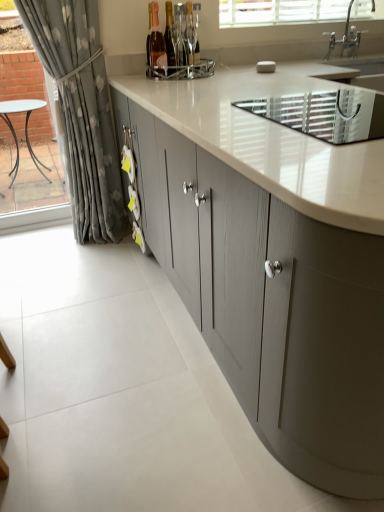
Question: Which direction should I rotate to look at matte glass bottle at center, which is the 1th bottle in right-to-left order, — up or down?

Choices:
 (A) up
 (B) down

Answer: (A)

Question: From the image's perspective, would you say matte glass bottle at center, which is the 1th bottle in right-to-left order, is positioned over clear glass window frame at left?

Choices:
 (A) no
 (B) yes

Answer: (B)

Question: Is matte glass bottle at center, which is the 1th bottle in right-to-left order, bigger than clear glass window frame at left?

Choices:
 (A) yes
 (B) no

Answer: (B)

Question: Are matte glass bottle at center, which is the 1th bottle in right-to-left order, and clear glass window frame at left beside each other?

Choices:
 (A) yes
 (B) no

Answer: (B)

Question: Does matte glass bottle at center, which is the third bottle from left to right, come behind clear glass window frame at left?

Choices:
 (A) yes
 (B) no

Answer: (A)

Question: From a real-world perspective, is matte glass bottle at center, which is the 1th bottle in right-to-left order, positioned under clear glass window frame at left based on gravity?

Choices:
 (A) yes
 (B) no

Answer: (B)

Question: Can you confirm if matte glass bottle at center, which is the 1th bottle in right-to-left order, is smaller than clear glass window frame at left?

Choices:
 (A) no
 (B) yes

Answer: (B)

Question: Is the depth of matte gray cabinets at center less than that of pink glass bottle at upper center, which is counted as the third bottle, starting from the right?

Choices:
 (A) yes
 (B) no

Answer: (A)

Question: Can pink glass bottle at upper center, which is counted as the third bottle, starting from the right, be found inside matte gray cabinets at center?

Choices:
 (A) yes
 (B) no

Answer: (B)

Question: From a real-world perspective, is matte gray cabinets at center beneath pink glass bottle at upper center, which is counted as the third bottle, starting from the right?

Choices:
 (A) yes
 (B) no

Answer: (A)

Question: Is matte gray cabinets at center looking in the opposite direction of pink glass bottle at upper center, which is counted as the third bottle, starting from the right?

Choices:
 (A) no
 (B) yes

Answer: (A)

Question: Are matte gray cabinets at center and pink glass bottle at upper center, which is counted as the third bottle, starting from the right, making contact?

Choices:
 (A) no
 (B) yes

Answer: (A)

Question: Is matte gray cabinets at center outside pink glass bottle at upper center, placed as the 1th bottle when sorted from left to right?

Choices:
 (A) yes
 (B) no

Answer: (A)

Question: From the image's perspective, does matte gray cabinets at center appear lower than white textured blinds at upper center?

Choices:
 (A) no
 (B) yes

Answer: (B)